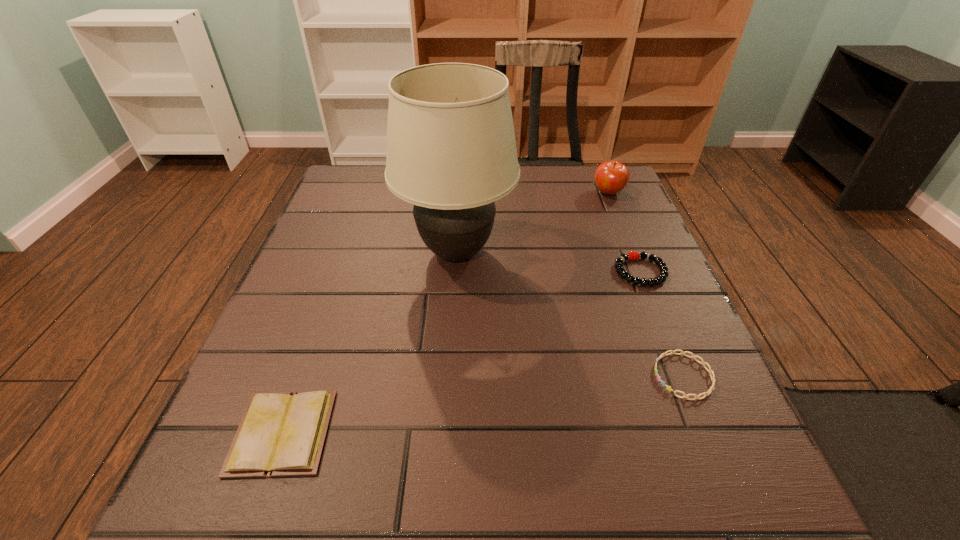
Where is `the tallest object`? The height and width of the screenshot is (540, 960). the tallest object is located at coordinates (451, 151).

Locate an element on the screen. lampshade is located at coordinates (451, 151).

This screenshot has width=960, height=540. Identify the location of the farthest object. (611, 177).

You are a GUI agent. You are given a task and a screenshot of the screen. Output one action in this format:
    pyautogui.click(x=<x>, y=<y>)
    Task: Click on the apple
    
    Given the screenshot: What is the action you would take?
    pyautogui.click(x=611, y=177)

At what (x,y) coordinates should I click in order to perform the action: click on the farther bracelet. Please return your answer as a coordinate pair (x, y). The image size is (960, 540). Looking at the image, I should click on (633, 255).

Locate an element on the screen. diary is located at coordinates pos(280,434).

I want to click on the nearer bracelet, so click(709, 370).

In order to click on the shortest object in this screenshot , I will do `click(709, 370)`.

In order to click on free spot located 0.110m on the back of the tallest object in this screenshot , I will do `click(460, 195)`.

Identify the location of blank area located 0.200m on the left of the second tallest object. (516, 193).